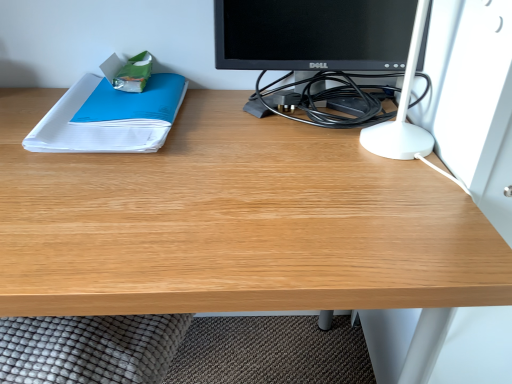
Locate an element on the screen. The width and height of the screenshot is (512, 384). free space in front of white paper at left is located at coordinates (106, 200).